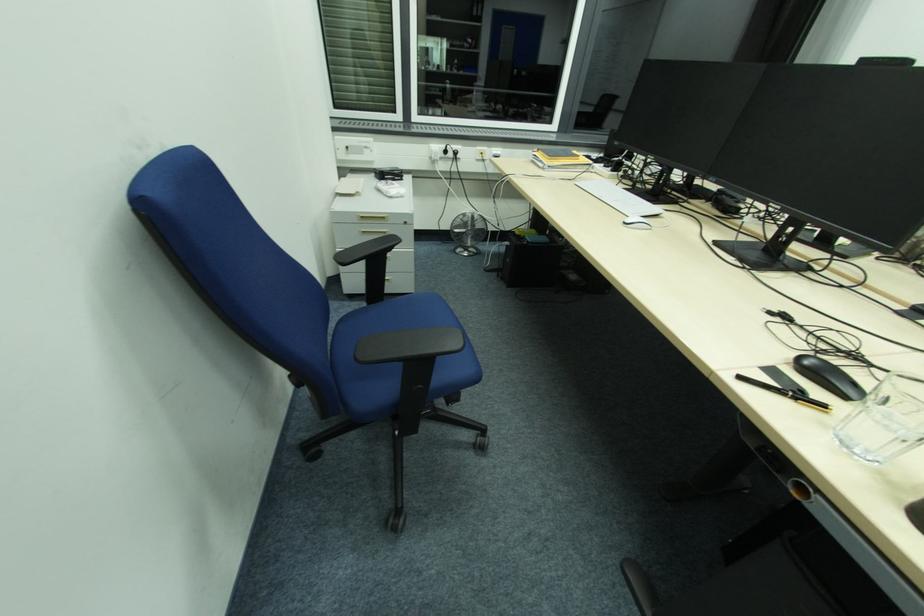
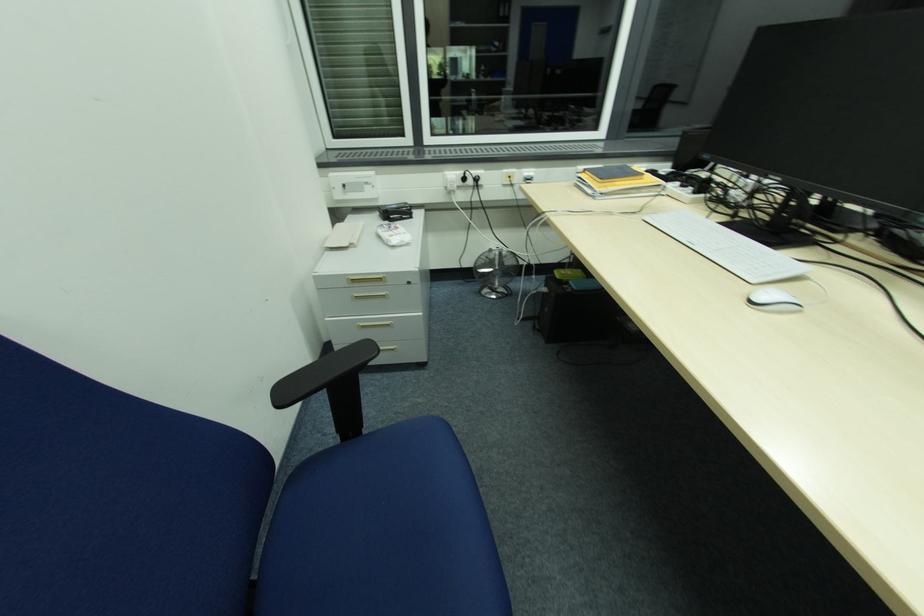
Question: The images are taken continuously from a first-person perspective. In which direction is your viewpoint rotating?

Choices:
 (A) Left
 (B) Right
 (C) Up
 (D) Down

Answer: (A)